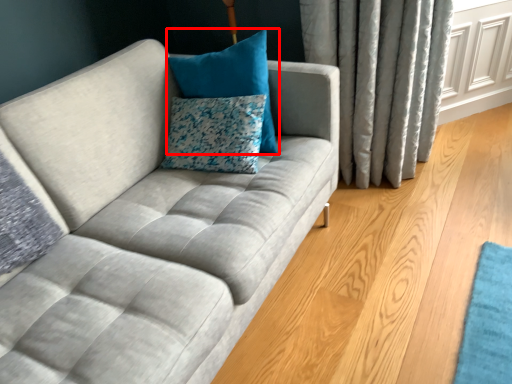
Question: Where is pillow (annotated by the red box) located in relation to pillow in the image?

Choices:
 (A) right
 (B) left

Answer: (A)